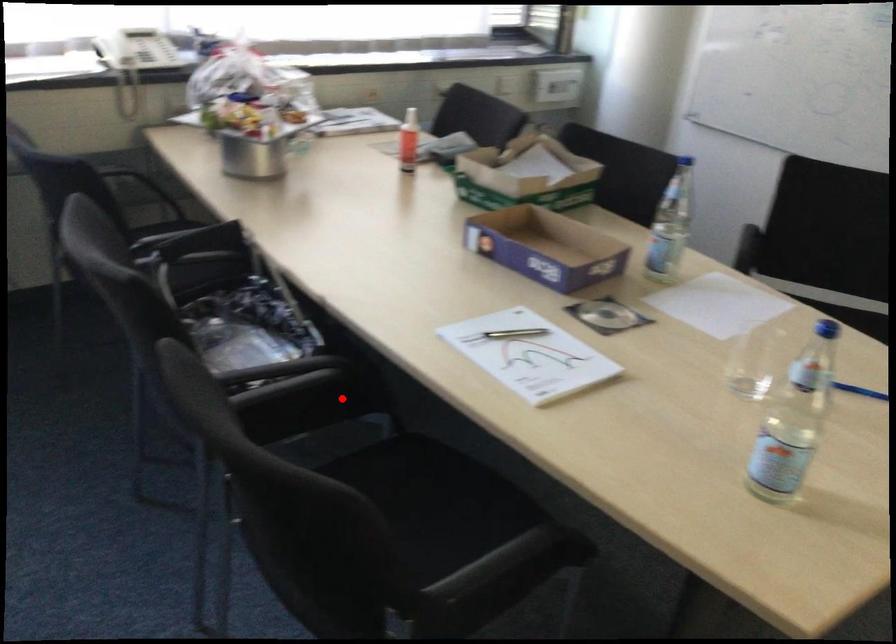
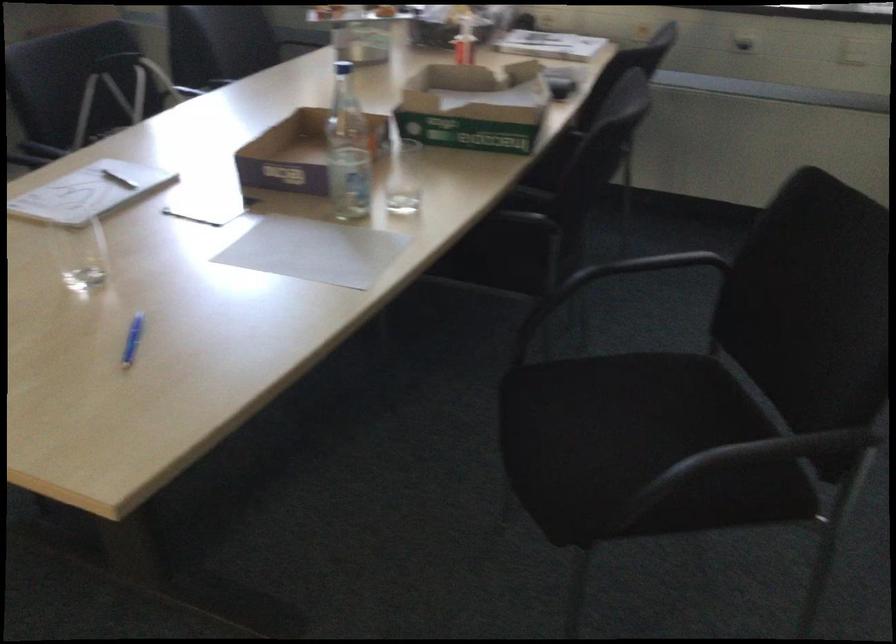
Question: I am providing you with two images of the same scene from different viewpoints. A red point is marked on the first image. Is the red point's position out of view in image 2?

Choices:
 (A) Yes
 (B) No

Answer: (A)